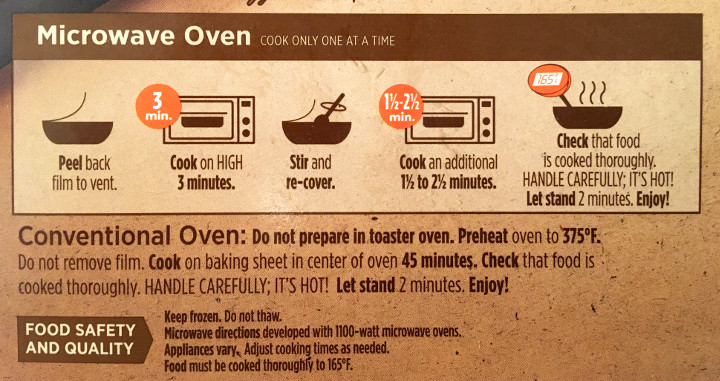
I want to click on dark brown box, so click(x=463, y=40).